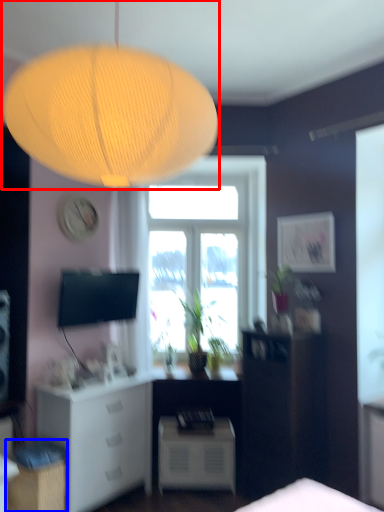
Question: Which object appears farthest to the camera in this image, lamp (highlighted by a red box) or cabinetry (highlighted by a blue box)?

Choices:
 (A) lamp
 (B) cabinetry

Answer: (B)